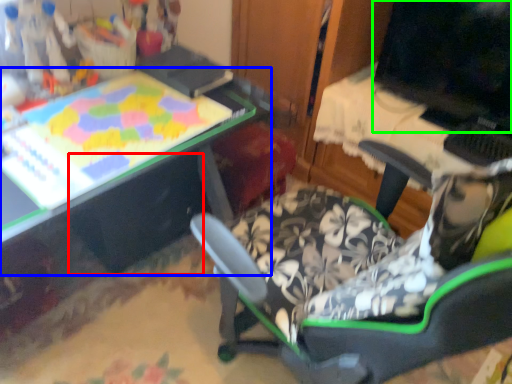
Question: Which object is the farthest from drawer (highlighted by a red box)? Choose among these: table (highlighted by a blue box) or computer monitor (highlighted by a green box).

Choices:
 (A) table
 (B) computer monitor

Answer: (B)